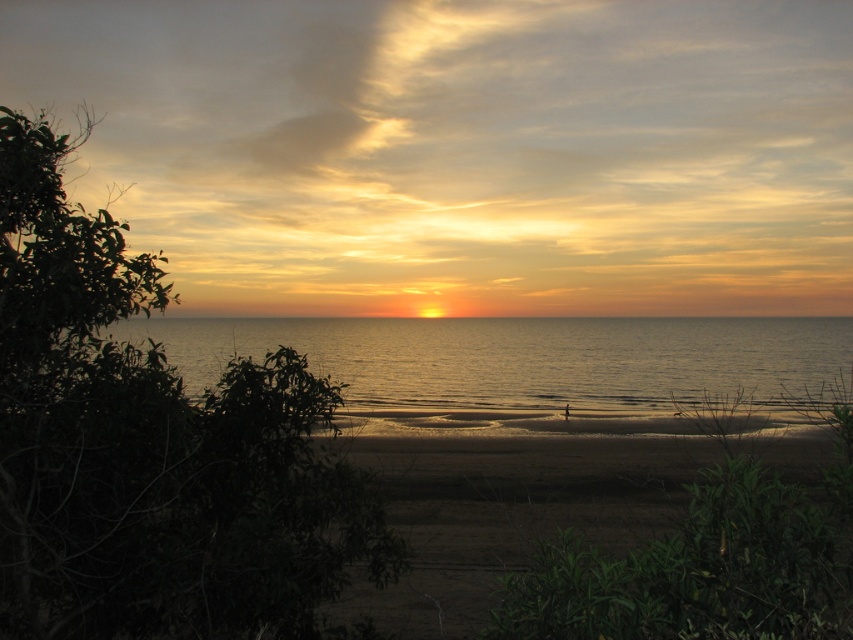
You are standing on the brown sandy beach at center and looking towards the golden reflective water at center. Which object is closer to your eyes?

The golden reflective water at center is closer to your eyes because it is positioned further to the viewer than the brown sandy beach at center.

From the picture: You are standing on the brown sandy beach at center and want to reach the golden reflective water at center. Which direction should you move in to get there?

The golden reflective water at center is located above the brown sandy beach at center, so you should move upward to reach it.